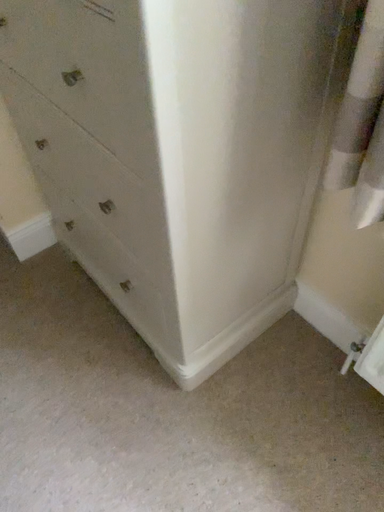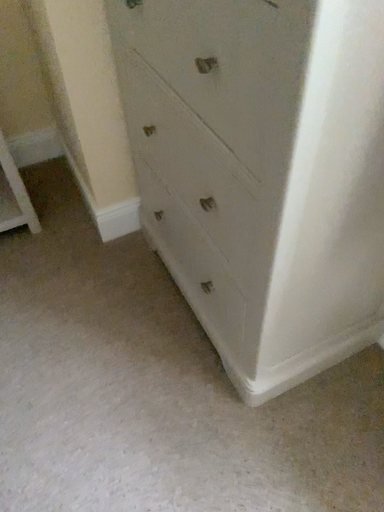
Question: How did the camera likely rotate when shooting the video?

Choices:
 (A) rotated left
 (B) rotated right

Answer: (A)